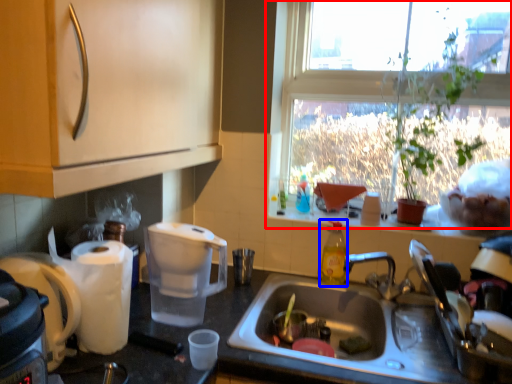
Question: Which object is closer to the camera taking this photo, window (highlighted by a red box) or bottle (highlighted by a blue box)?

Choices:
 (A) window
 (B) bottle

Answer: (A)